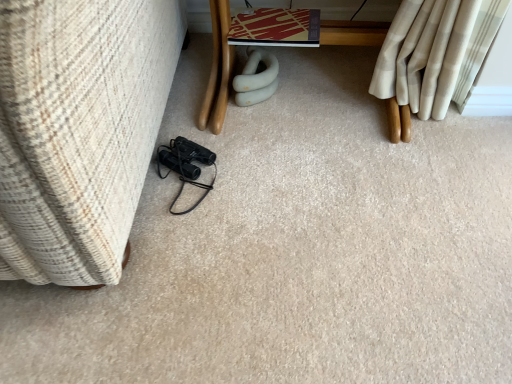
Find the location of a particular element. The image size is (512, 384). vacant space in wooden table at center (from a real-world perspective) is located at coordinates (325, 99).